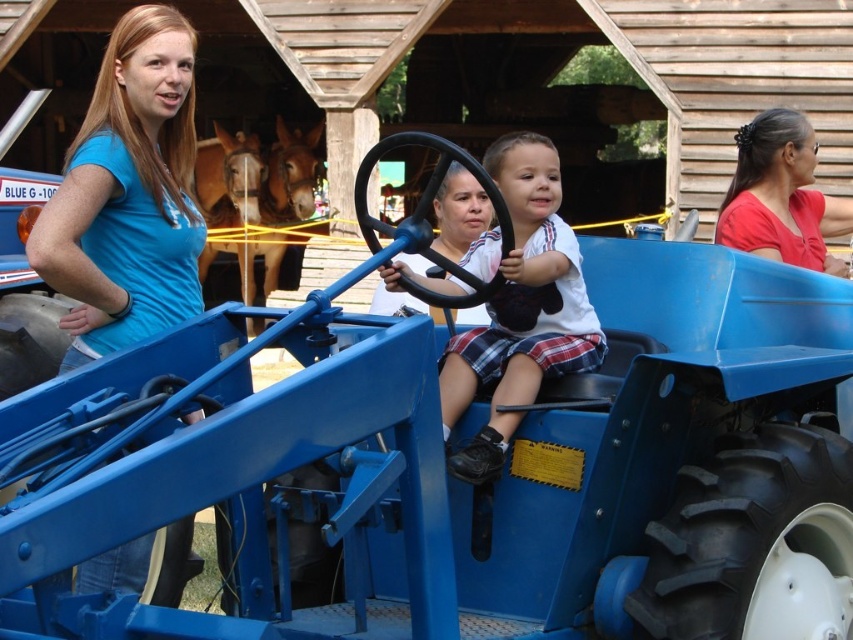
Who is shorter, blue t-shirt at upper left or matte red shirt at right?

With less height is matte red shirt at right.

Which is below, blue t-shirt at upper left or matte red shirt at right?

blue t-shirt at upper left is below.

The image size is (853, 640). Describe the element at coordinates (126, 195) in the screenshot. I see `blue t-shirt at upper left` at that location.

The image size is (853, 640). What are the coordinates of `blue t-shirt at upper left` in the screenshot? It's located at (126, 195).

Who is positioned more to the right, blue t-shirt at upper left or matte blue tractor at center?

matte blue tractor at center

Which is in front, point (80, 209) or point (515, 353)?

Positioned in front is point (515, 353).

Which is in front, point (91, 129) or point (520, 138)?

Point (91, 129) is more forward.

At what (x,y) coordinates should I click in order to perform the action: click on blue t-shirt at upper left. Please return your answer as a coordinate pair (x, y). This screenshot has width=853, height=640. Looking at the image, I should click on (126, 195).

Which is below, matte blue tractor at center or matte red shirt at right?

Positioned lower is matte blue tractor at center.

What do you see at coordinates (519, 307) in the screenshot? The image size is (853, 640). I see `matte blue tractor at center` at bounding box center [519, 307].

In order to click on matte blue tractor at center in this screenshot , I will do `click(519, 307)`.

Locate an element on the screen. Image resolution: width=853 pixels, height=640 pixels. matte blue tractor at center is located at coordinates (519, 307).